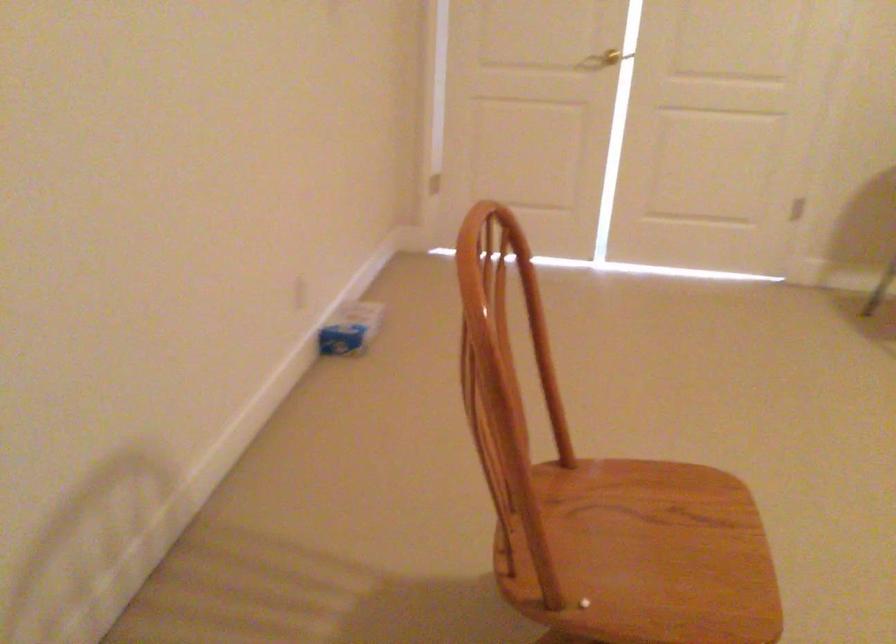
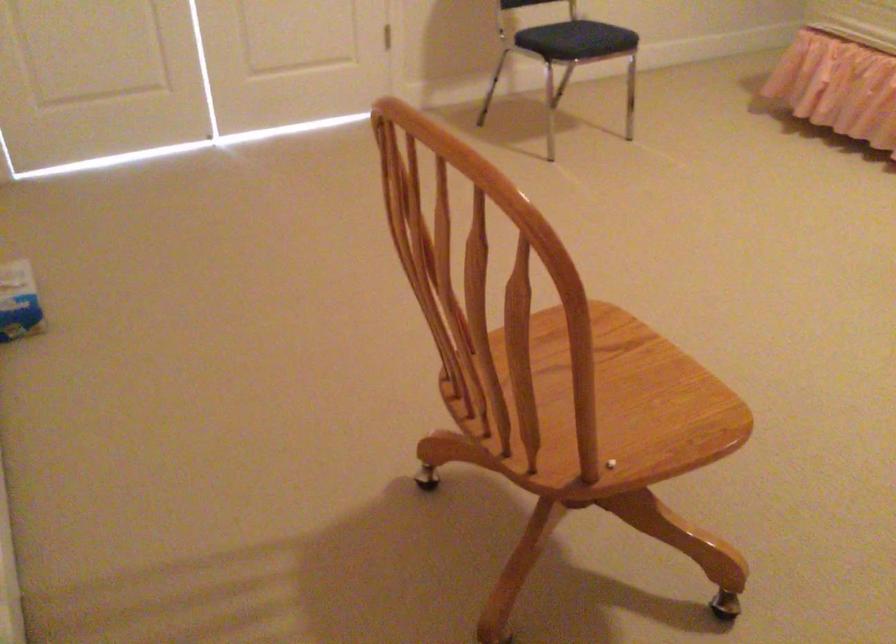
Question: How did the camera likely rotate?

Choices:
 (A) Left
 (B) Right
 (C) Up
 (D) Down

Answer: (B)